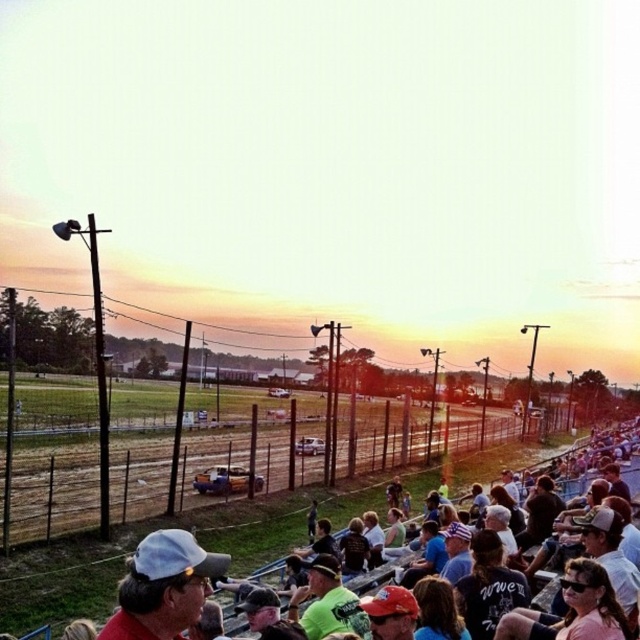
You are a photographer at the motorsport event and want to capture a photo of the dark gray shirt at center without the matte black cap at center blocking it. How can you adjust your camera angle to achieve this?

Since the matte black cap at center is located above the dark gray shirt at center, you can lower your camera angle to position it below the cap, ensuring the shirt remains visible while avoiding the cap blocking the view.

You are a photographer at the motorsport event. You want to take a photo of the crowd, focusing on the two caps at the center. Which cap, the matte red cap at center or the matte black cap at center, will appear taller in the photo?

The matte red cap at center will appear taller in the photo because it is much taller than the matte black cap at center.